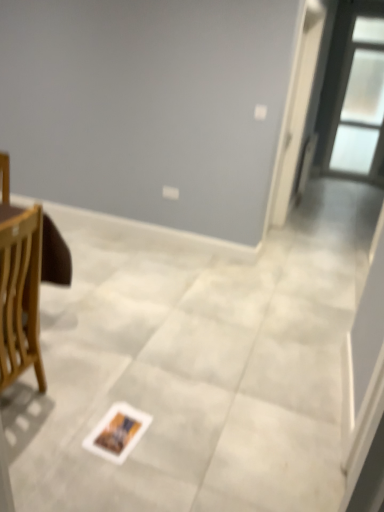
Question: Is transparent glass window at upper right next to white paper postcard at center and touching it?

Choices:
 (A) yes
 (B) no

Answer: (B)

Question: From the image's perspective, is transparent glass window at upper right over white paper postcard at center?

Choices:
 (A) no
 (B) yes

Answer: (B)

Question: Does transparent glass window at upper right have a lesser width compared to white paper postcard at center?

Choices:
 (A) yes
 (B) no

Answer: (A)

Question: Could you tell me if transparent glass window at upper right is turned towards white paper postcard at center?

Choices:
 (A) yes
 (B) no

Answer: (A)

Question: Is transparent glass window at upper right at the left side of white paper postcard at center?

Choices:
 (A) yes
 (B) no

Answer: (B)

Question: From the image's perspective, is transparent glass window at upper right above or below white glossy screen door at upper right?

Choices:
 (A) above
 (B) below

Answer: (A)

Question: Considering the positions of transparent glass window at upper right and white glossy screen door at upper right in the image, is transparent glass window at upper right wider or thinner than white glossy screen door at upper right?

Choices:
 (A) wide
 (B) thin

Answer: (B)

Question: From a real-world perspective, is transparent glass window at upper right physically located above or below white glossy screen door at upper right?

Choices:
 (A) below
 (B) above

Answer: (A)

Question: Would you say transparent glass window at upper right is inside or outside white glossy screen door at upper right?

Choices:
 (A) outside
 (B) inside

Answer: (A)

Question: In the image, is white glossy screen door at upper right positioned in front of or behind transparent glass window at upper right?

Choices:
 (A) front
 (B) behind

Answer: (A)

Question: Based on their sizes in the image, would you say white glossy screen door at upper right is bigger or smaller than transparent glass window at upper right?

Choices:
 (A) big
 (B) small

Answer: (A)

Question: From a real-world perspective, is white glossy screen door at upper right positioned above or below transparent glass window at upper right?

Choices:
 (A) below
 (B) above

Answer: (B)

Question: In terms of width, does white glossy screen door at upper right look wider or thinner when compared to transparent glass window at upper right?

Choices:
 (A) wide
 (B) thin

Answer: (A)

Question: Is point (100, 423) positioned closer to the camera than point (380, 8)?

Choices:
 (A) closer
 (B) farther

Answer: (A)

Question: Looking at their shapes, would you say white paper postcard at center is wider or thinner than transparent glass window at upper right?

Choices:
 (A) thin
 (B) wide

Answer: (B)